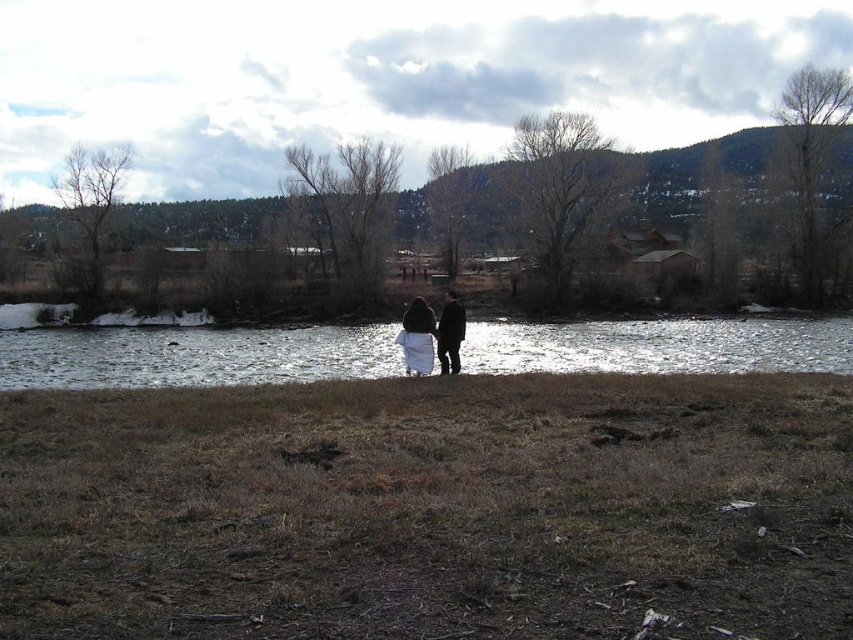
Which is in front, point (426, 337) or point (444, 337)?

Positioned in front is point (426, 337).

Who is lower down, white wool coat at center or black matte coat at center?

white wool coat at center is below.

You are a GUI agent. You are given a task and a screenshot of the screen. Output one action in this format:
    pyautogui.click(x=<x>, y=<y>)
    Task: Click on the white wool coat at center
    
    Given the screenshot: What is the action you would take?
    pos(432,336)

Which is in front, point (352, 346) or point (447, 353)?

Point (447, 353) is in front.

Describe the element at coordinates (193, 355) in the screenshot. The image size is (853, 640). I see `reflective silver water at center` at that location.

Identify the location of reflective silver water at center. The height and width of the screenshot is (640, 853). (193, 355).

Is reflective silver water at center to the left of black matte coat at center from the viewer's perspective?

Indeed, reflective silver water at center is positioned on the left side of black matte coat at center.

Is reflective silver water at center above black matte coat at center?

No, reflective silver water at center is not above black matte coat at center.

Who is more forward, (195, 337) or (445, 348)?

Point (445, 348) is in front.

Where is `reflective silver water at center`? reflective silver water at center is located at coordinates (193, 355).